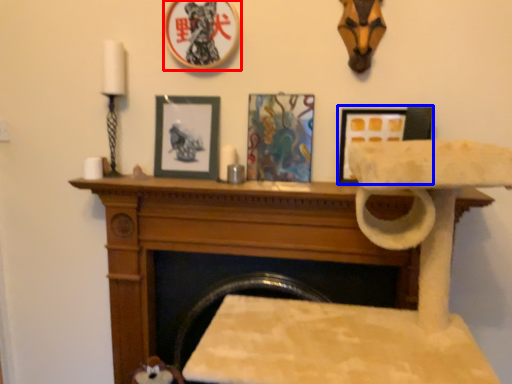
Question: Among these objects, which one is nearest to the camera, picture frame (highlighted by a red box) or picture frame (highlighted by a blue box)?

Choices:
 (A) picture frame
 (B) picture frame

Answer: (A)